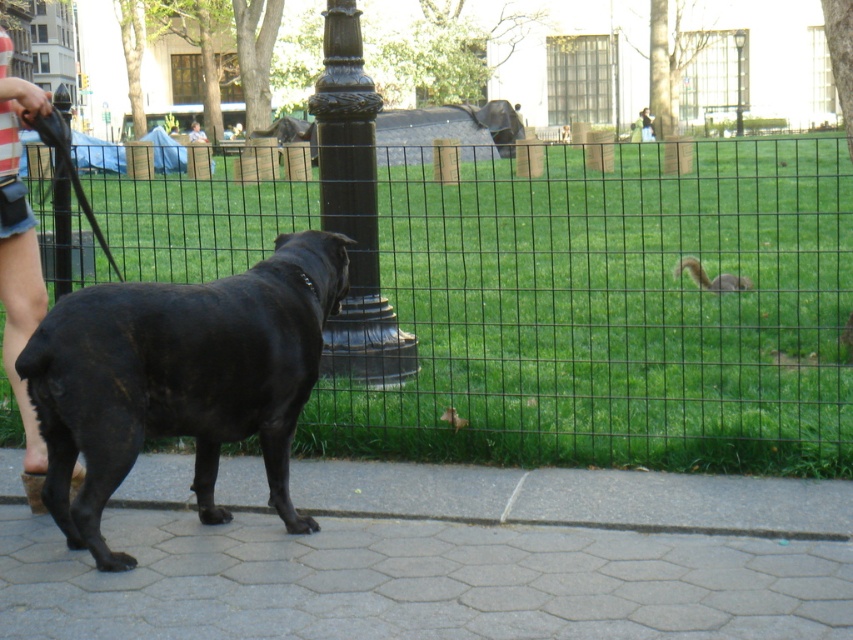
Based on the photo, does black wire mesh fence at center appear on the left side of striped fabric leg at lower left?

In fact, black wire mesh fence at center is to the right of striped fabric leg at lower left.

This screenshot has width=853, height=640. Identify the location of black wire mesh fence at center. (613, 314).

Is black polished metal pole at center above metallic glass lamp post at upper center?

Incorrect, black polished metal pole at center is not positioned above metallic glass lamp post at upper center.

Is the position of black polished metal pole at center more distant than that of metallic glass lamp post at upper center?

That is False.

Does point (358, 333) lie in front of point (737, 112)?

That is True.

Find the location of a particular element. black polished metal pole at center is located at coordinates (354, 209).

Who is more forward, (531, 211) or (482, 509)?

Positioned in front is point (482, 509).

Which is behind, point (633, 378) or point (225, 621)?

Positioned behind is point (633, 378).

Who is more distant from viewer, (x=843, y=358) or (x=509, y=493)?

The point (x=843, y=358) is more distant.

I want to click on black wire mesh fence at center, so click(x=613, y=314).